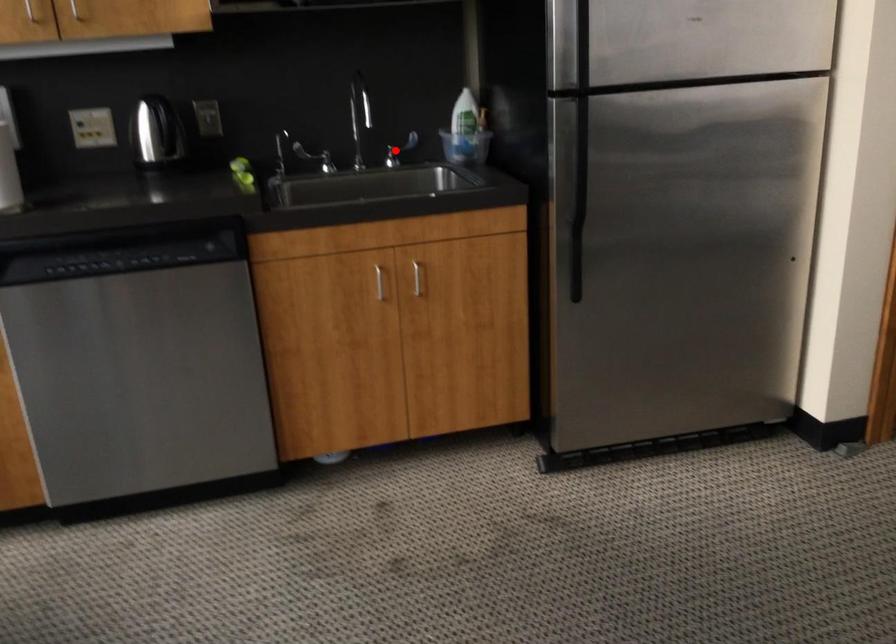
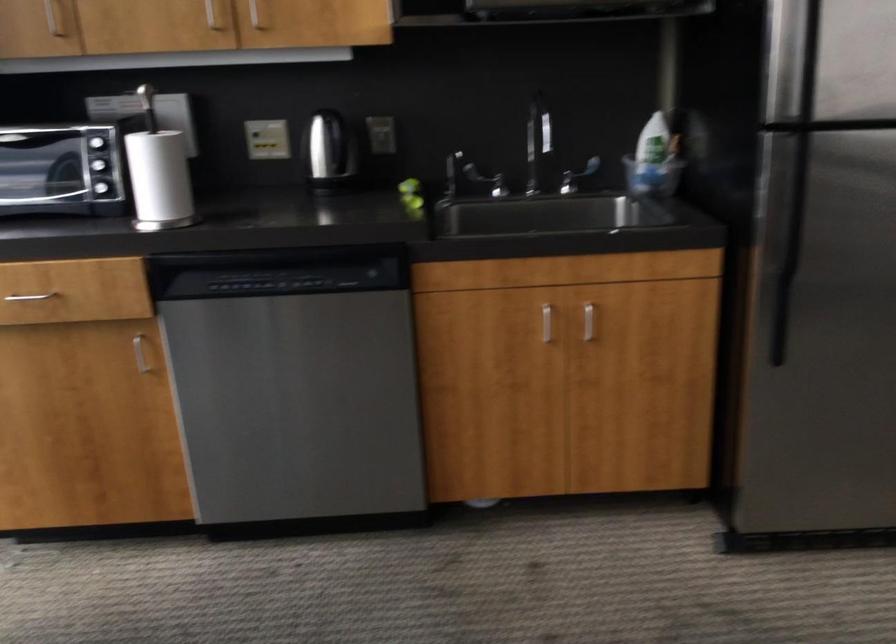
In the second image, find the point that corresponds to the highlighted location in the first image.

(576, 176)